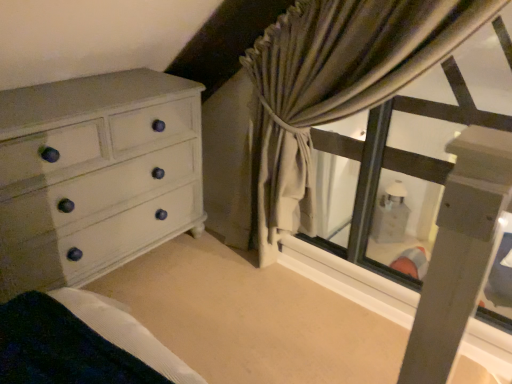
Question: Does textured beige curtain at upper right have a lesser width compared to white painted wood chest of drawers at left?

Choices:
 (A) no
 (B) yes

Answer: (B)

Question: Could white painted wood chest of drawers at left be considered to be inside textured beige curtain at upper right?

Choices:
 (A) yes
 (B) no

Answer: (B)

Question: Is textured beige curtain at upper right turned away from white painted wood chest of drawers at left?

Choices:
 (A) yes
 (B) no

Answer: (B)

Question: Is textured beige curtain at upper right behind white painted wood chest of drawers at left?

Choices:
 (A) no
 (B) yes

Answer: (A)

Question: Is textured beige curtain at upper right far from white painted wood chest of drawers at left?

Choices:
 (A) no
 (B) yes

Answer: (A)

Question: From a real-world perspective, is textured beige curtain at upper right positioned over white painted wood chest of drawers at left based on gravity?

Choices:
 (A) no
 (B) yes

Answer: (B)

Question: Is textured beige curtain at upper right completely or partially inside white painted wood chest of drawers at left?

Choices:
 (A) yes
 (B) no

Answer: (B)

Question: Is white painted wood chest of drawers at left wider than textured beige curtain at upper right?

Choices:
 (A) no
 (B) yes

Answer: (B)

Question: From the image's perspective, is white painted wood chest of drawers at left below textured beige curtain at upper right?

Choices:
 (A) no
 (B) yes

Answer: (B)

Question: Are white painted wood chest of drawers at left and textured beige curtain at upper right far apart?

Choices:
 (A) no
 (B) yes

Answer: (A)

Question: Is white painted wood chest of drawers at left positioned behind textured beige curtain at upper right?

Choices:
 (A) yes
 (B) no

Answer: (A)

Question: Could you tell me if white painted wood chest of drawers at left is turned towards textured beige curtain at upper right?

Choices:
 (A) no
 (B) yes

Answer: (B)

Question: From the image's perspective, is white painted wood chest of drawers at left positioned above or below textured beige curtain at upper right?

Choices:
 (A) above
 (B) below

Answer: (B)